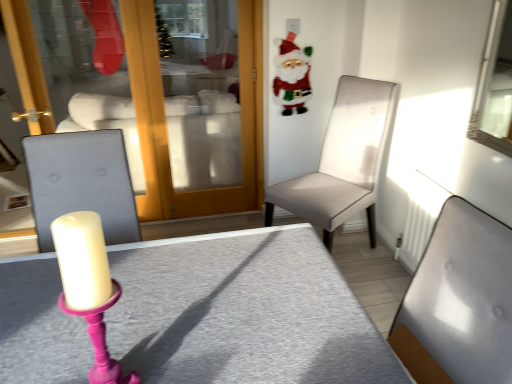
Question: Is gray fabric table at center inside the boundaries of light beige fabric chair at center right, which is the second chair from front to back, or outside?

Choices:
 (A) outside
 (B) inside

Answer: (A)

Question: Considering the positions of gray fabric table at center and light beige fabric chair at center right, which is the 1th chair in back-to-front order, in the image, is gray fabric table at center taller or shorter than light beige fabric chair at center right, which is the 1th chair in back-to-front order,?

Choices:
 (A) short
 (B) tall

Answer: (A)

Question: Based on their relative distances, which object is nearer to the felt santa claus at upper right?

Choices:
 (A) gray fabric table at center
 (B) light beige fabric chair at center right, which is the 1th chair in back-to-front order
 (C) light gray fabric chair at center, the first chair when ordered from front to back

Answer: (B)

Question: Estimate the real-world distances between objects in this image. Which object is farther from the light gray fabric chair at center, which is counted as the second chair, starting from the back?

Choices:
 (A) gray fabric table at center
 (B) felt santa claus at upper right
 (C) light beige fabric chair at center right, which is the second chair from front to back

Answer: (B)